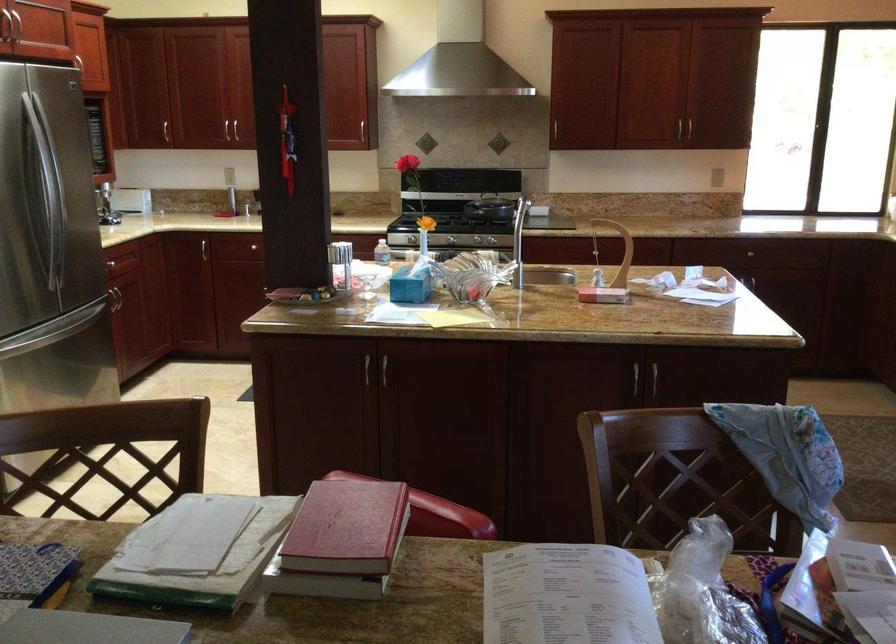
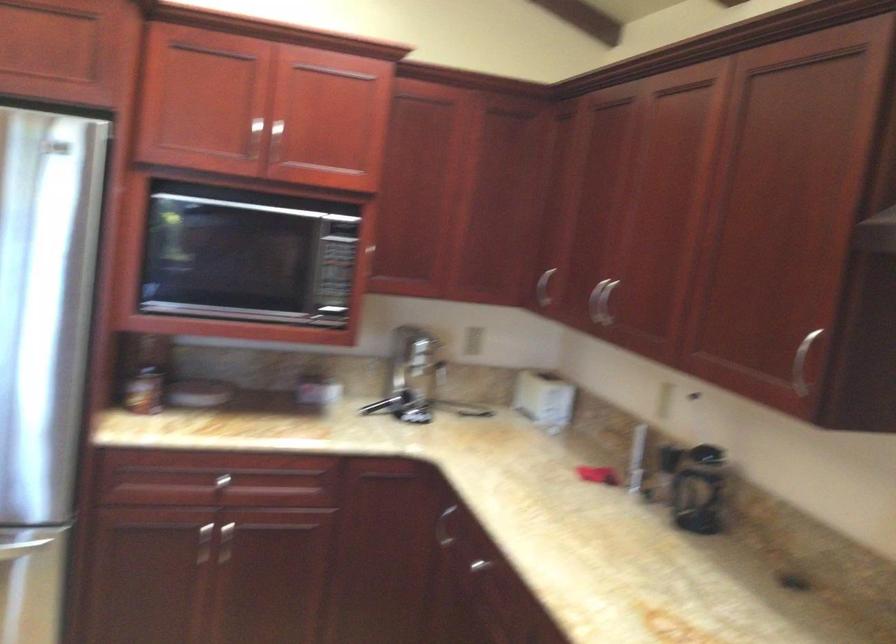
Find the pixel in the second image that matches (x=229, y=192) in the first image.

(699, 489)